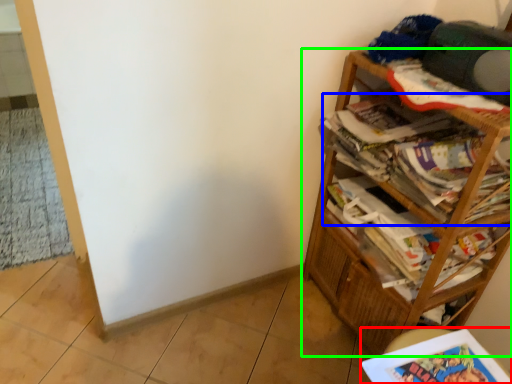
Question: Based on their relative distances, which object is farther from book (highlighted by a red box)? Choose from magazine (highlighted by a blue box) and bookcase (highlighted by a green box).

Choices:
 (A) magazine
 (B) bookcase

Answer: (A)